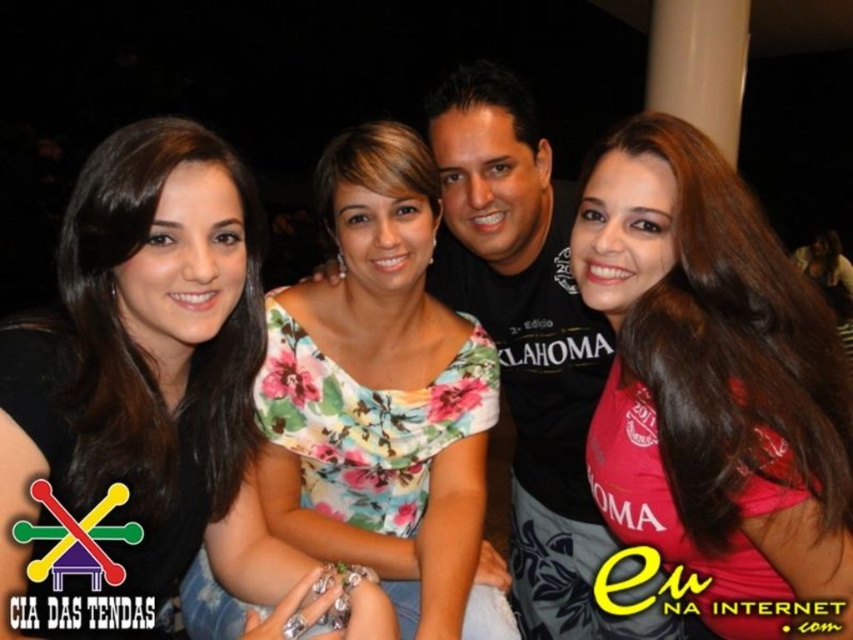
Can you confirm if pink jersey at right is wider than floral fabric dress at center?

Incorrect, pink jersey at right's width does not surpass floral fabric dress at center's.

Is point (775, 616) farther from camera compared to point (260, 486)?

No, (775, 616) is in front of (260, 486).

I want to click on pink jersey at right, so click(715, 390).

This screenshot has width=853, height=640. Describe the element at coordinates (148, 408) in the screenshot. I see `floral fabric dress at upper center` at that location.

Between point (9, 588) and point (321, 529), which one is positioned in front?

Positioned in front is point (9, 588).

Identify the location of floral fabric dress at upper center. click(x=148, y=408).

Does floral fabric dress at upper center have a larger size compared to pink jersey at right?

Indeed, floral fabric dress at upper center has a larger size compared to pink jersey at right.

Is floral fabric dress at upper center behind pink jersey at right?

No, it is not.

Between point (192, 371) and point (752, 400), which one is positioned in front?

Point (752, 400)

This screenshot has height=640, width=853. I want to click on floral fabric dress at upper center, so click(148, 408).